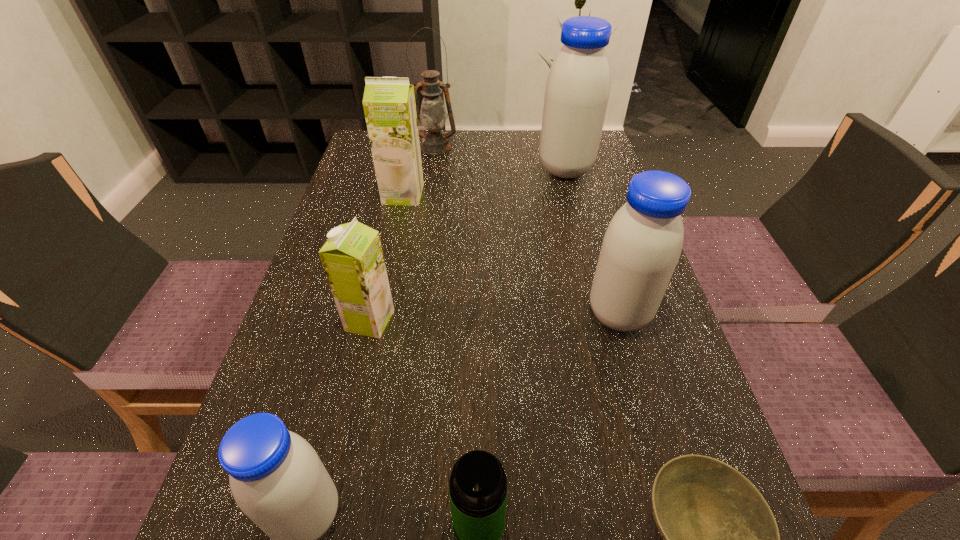
Identify the location of the tallest soya milk. (577, 90).

The width and height of the screenshot is (960, 540). Identify the location of the farthest blue soya milk. (577, 90).

You are a GUI agent. You are given a task and a screenshot of the screen. Output one action in this format:
    pyautogui.click(x=<x>, y=<y>)
    Task: Click on the oil lamp
    The height and width of the screenshot is (540, 960).
    Given the screenshot: What is the action you would take?
    pyautogui.click(x=433, y=116)

Locate an element on the screen. This screenshot has height=540, width=960. the bigger green soya milk is located at coordinates (389, 105).

Locate an element on the screen. The height and width of the screenshot is (540, 960). the second biggest blue soya milk is located at coordinates coord(642,245).

The width and height of the screenshot is (960, 540). I want to click on the nearer green soya milk, so click(x=352, y=258).

Find the location of a particular element. This screenshot has height=540, width=960. free location located on the front of the biggest blue soya milk is located at coordinates (573, 200).

The height and width of the screenshot is (540, 960). I want to click on free location located 0.060m on the left of the oil lamp, so click(x=396, y=147).

This screenshot has height=540, width=960. Find the location of `free space located 0.230m on the front of the farther green soya milk`. free space located 0.230m on the front of the farther green soya milk is located at coordinates (387, 268).

You are a GUI agent. You are given a task and a screenshot of the screen. Output one action in this format:
    pyautogui.click(x=<x>, y=<y>)
    Task: Click on the free location located on the back of the second biggest blue soya milk
    
    Given the screenshot: What is the action you would take?
    pyautogui.click(x=588, y=210)